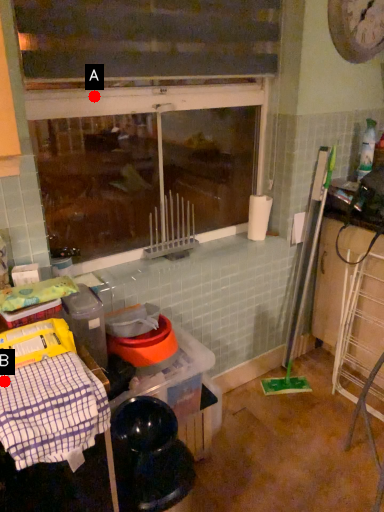
Question: Two points are circled on the image, labeled by A and B beside each circle. Which point is closer to the camera taking this photo?

Choices:
 (A) A is closer
 (B) B is closer

Answer: (B)